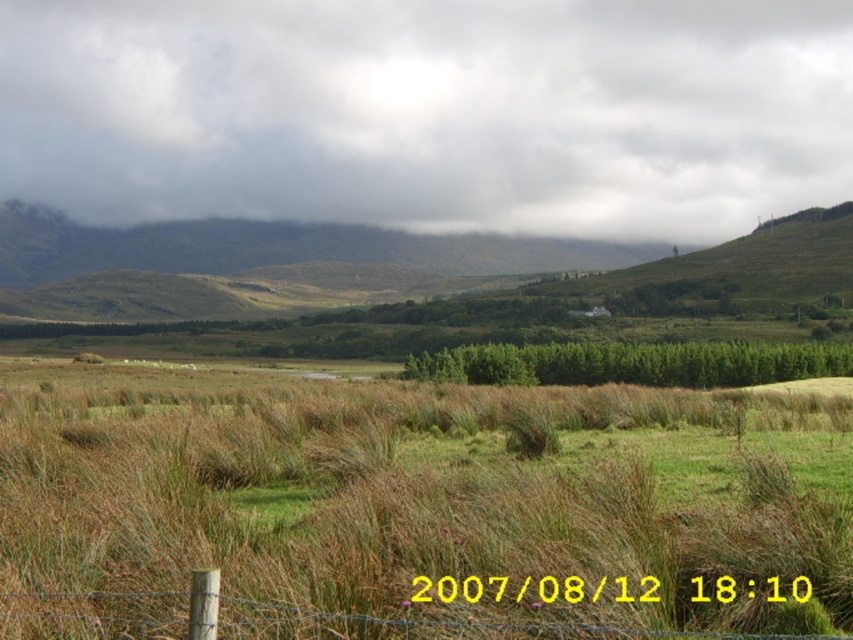
Does brown dry grass at center appear on the left side of cloudy gray sky at upper center?

Yes, brown dry grass at center is to the left of cloudy gray sky at upper center.

Which of these two, brown dry grass at center or cloudy gray sky at upper center, stands taller?

cloudy gray sky at upper center is taller.

Who is more distant from viewer, (x=503, y=445) or (x=659, y=8)?

The point (x=659, y=8) is more distant.

Find the location of a particular element. Image resolution: width=853 pixels, height=640 pixels. brown dry grass at center is located at coordinates (413, 508).

Is brown dry grass at center wider than brown wooden fence at lower center?

Indeed, brown dry grass at center has a greater width compared to brown wooden fence at lower center.

What do you see at coordinates (413, 508) in the screenshot? Image resolution: width=853 pixels, height=640 pixels. I see `brown dry grass at center` at bounding box center [413, 508].

Describe the element at coordinates (413, 508) in the screenshot. The height and width of the screenshot is (640, 853). I see `brown dry grass at center` at that location.

Find the location of `brown dry grass at center`. brown dry grass at center is located at coordinates (413, 508).

Is cloudy gray sky at upper center thinner than brown wooden fence at lower center?

No.

Is cloudy gray sky at upper center smaller than brown wooden fence at lower center?

No.

What do you see at coordinates (430, 113) in the screenshot? I see `cloudy gray sky at upper center` at bounding box center [430, 113].

Where is `cloudy gray sky at upper center`? Image resolution: width=853 pixels, height=640 pixels. cloudy gray sky at upper center is located at coordinates (x=430, y=113).